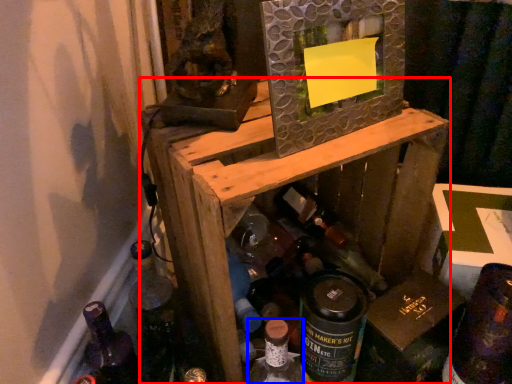
Question: Which object is closer to the camera taking this photo, furniture (highlighted by a red box) or bottle (highlighted by a blue box)?

Choices:
 (A) furniture
 (B) bottle

Answer: (A)